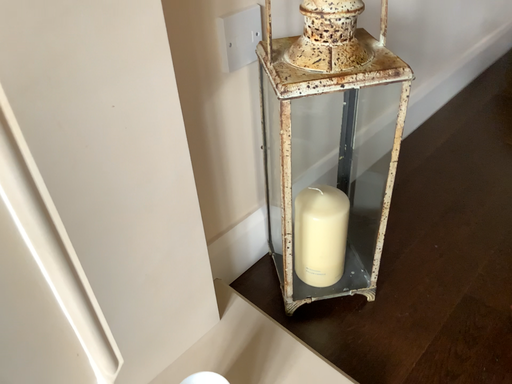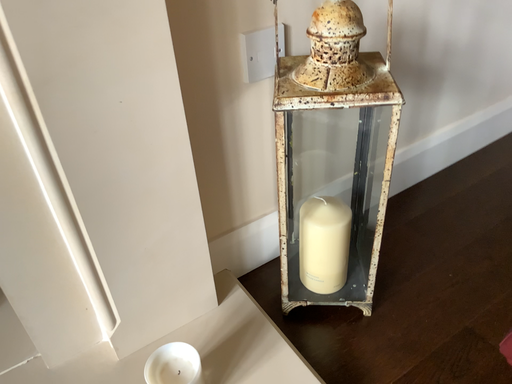
Question: Which way did the camera rotate in the video?

Choices:
 (A) rotated right
 (B) rotated left

Answer: (B)